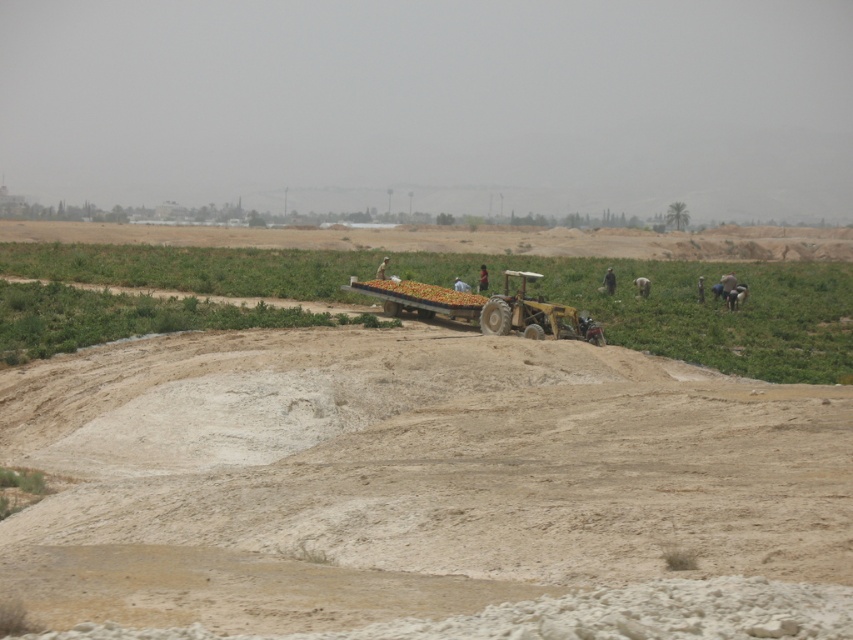
Find the location of `light brown sandy at center`. light brown sandy at center is located at coordinates 403,476.

This screenshot has width=853, height=640. I want to click on light brown sandy at center, so click(x=403, y=476).